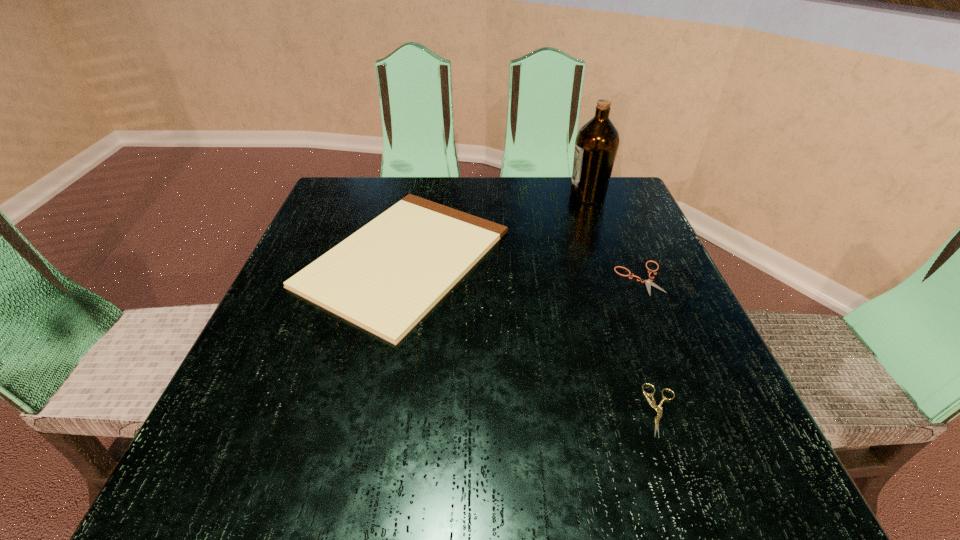
You are a GUI agent. You are given a task and a screenshot of the screen. Output one action in this format:
    pyautogui.click(x=<x>, y=<y>)
    Task: Click on the blank space at the near edge of the desktop
    Image resolution: width=960 pixels, height=540 pixels.
    Given the screenshot: What is the action you would take?
    pyautogui.click(x=468, y=503)

This screenshot has height=540, width=960. In order to click on free region at the left edge in this screenshot , I will do `click(303, 312)`.

Image resolution: width=960 pixels, height=540 pixels. What are the coordinates of `free region at the right edge of the desktop` in the screenshot? It's located at (627, 282).

The height and width of the screenshot is (540, 960). Find the location of `vacant position at the far left corner of the desktop`. vacant position at the far left corner of the desktop is located at coordinates pyautogui.click(x=375, y=199).

Find the location of a particular element. The height and width of the screenshot is (540, 960). vacant region at the far right corner is located at coordinates click(x=607, y=206).

Where is `free area in between the nearest object and the clipboard`? Image resolution: width=960 pixels, height=540 pixels. free area in between the nearest object and the clipboard is located at coordinates (534, 334).

The height and width of the screenshot is (540, 960). What are the coordinates of `vacant space in between the farther shears and the tallest object` in the screenshot? It's located at (614, 237).

Find the location of a particular element. vacant area that lies between the third shortest object and the nearest object is located at coordinates (534, 334).

The width and height of the screenshot is (960, 540). I want to click on empty space that is in between the leftmost object and the farther shears, so [522, 268].

The width and height of the screenshot is (960, 540). I want to click on vacant point located between the farther shears and the leftmost object, so click(x=522, y=268).